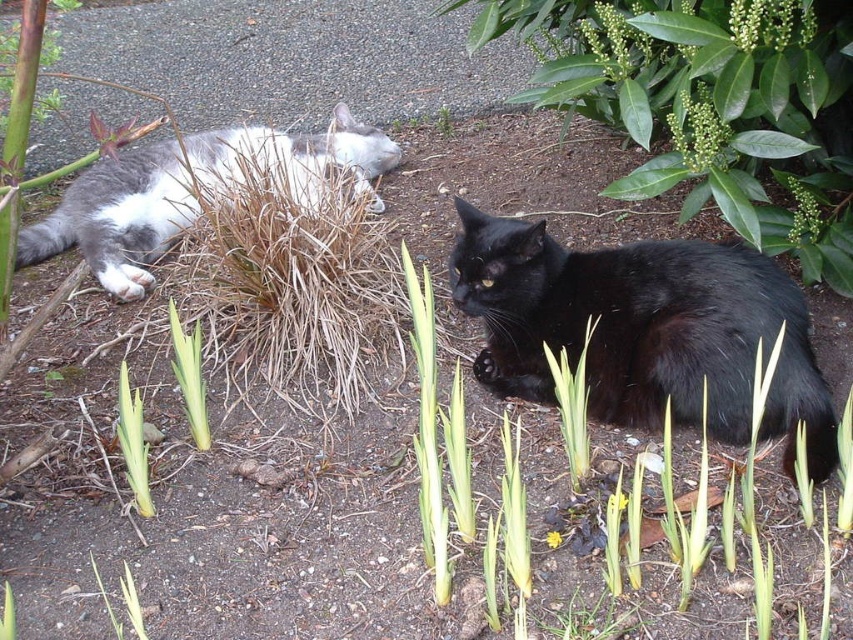
You are a photographer trying to capture a picture of the black cat in the foreground. You want to ensure that the green leafy bush at upper right does not appear in the background of your photo. Based on the coordinates provided, can you determine if the bush will be visible in the background?

The green leafy bush at upper right is located at coordinates point (709, 106), which is in the upper right corner of the frame. Since the black cat is in the foreground facing slightly left, the bush at upper right is likely outside the main focus area and may not be visible in the background of the photo.

You are standing in the garden and want to place a small bird feeder exactly at the point marked by coordinates point (709, 106). Based on the scene, where will the bird feeder be placed?

The point (709, 106) is marked at the green leafy bush at upper right, so placing the bird feeder there would position it on the green leafy bush at upper right.